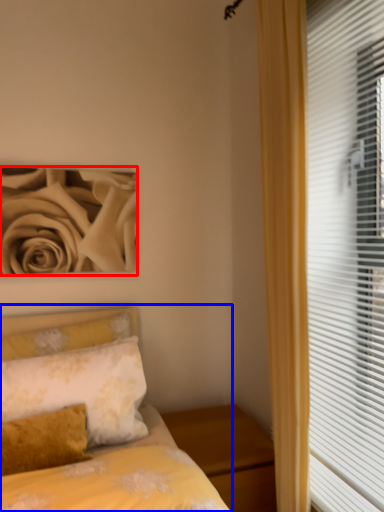
Question: Which object is closer to the camera taking this photo, rose (highlighted by a red box) or bed (highlighted by a blue box)?

Choices:
 (A) rose
 (B) bed

Answer: (B)